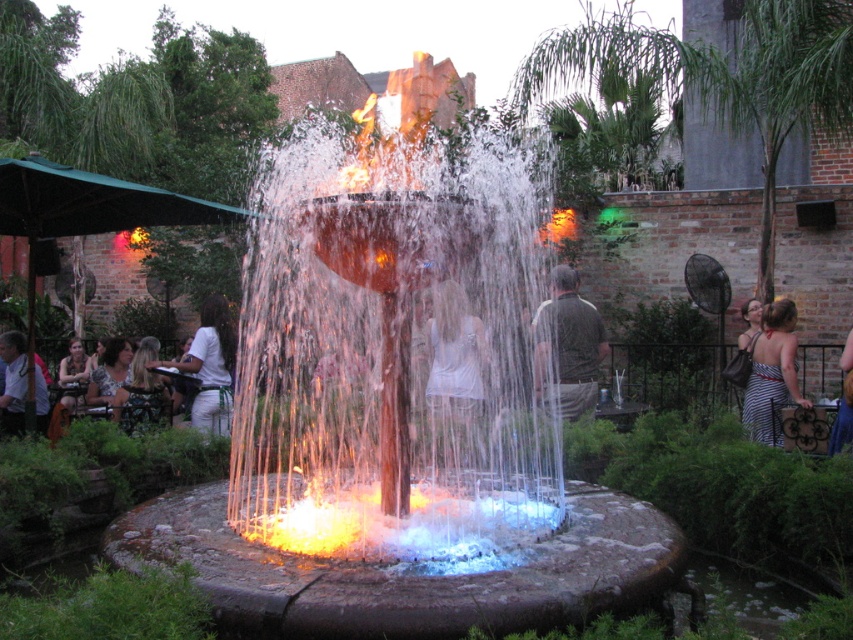
Question: Does glowing orange fire at center come behind white fabric shirt at left?

Choices:
 (A) no
 (B) yes

Answer: (A)

Question: Based on their relative distances, which object is nearer to the light brown leather jacket at lower left?

Choices:
 (A) white fabric shirt at left
 (B) translucent glass water at center

Answer: (A)

Question: Is translucent glass fire at center thinner than striped fabric dress at center?

Choices:
 (A) yes
 (B) no

Answer: (B)

Question: Where is white fabric dress at center located in relation to striped fabric dress at center in the image?

Choices:
 (A) right
 (B) left

Answer: (B)

Question: Based on their relative distances, which object is farther from the translucent glass water at center?

Choices:
 (A) glowing orange fire at center
 (B) fluorescent orange flames at center

Answer: (A)

Question: Estimate the real-world distances between objects in this image. Which object is farther from the translucent glass fire at center?

Choices:
 (A) dark gray shirt at center
 (B) light brown leather jacket at lower left
 (C) fluorescent orange flames at center
 (D) white fabric shirt at left

Answer: (B)